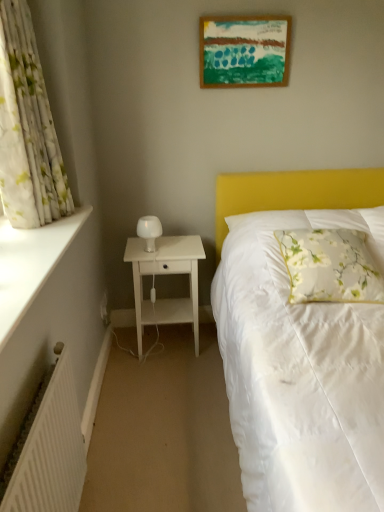
Find the location of `wooden picture frame at upper center`. wooden picture frame at upper center is located at coordinates (245, 51).

Identify the location of white matte nightstand at left. The height and width of the screenshot is (512, 384). point(163,274).

Where is `white ribbed radiator at lower left`? white ribbed radiator at lower left is located at coordinates (48, 448).

What is the approximate height of floral fabric pillow at right?

floral fabric pillow at right is 10.59 inches tall.

This screenshot has width=384, height=512. What are the coordinates of `white smooth window sill at left` in the screenshot? It's located at (x=30, y=264).

Is floral fabric pillow at right smaller than white ribbed radiator at lower left?

Incorrect, floral fabric pillow at right is not smaller in size than white ribbed radiator at lower left.

Can you confirm if floral fabric pillow at right is taller than white ribbed radiator at lower left?

No, floral fabric pillow at right is not taller than white ribbed radiator at lower left.

Considering the relative sizes of floral fabric pillow at right and white ribbed radiator at lower left in the image provided, is floral fabric pillow at right wider than white ribbed radiator at lower left?

Yes, floral fabric pillow at right is wider than white ribbed radiator at lower left.

From a real-world perspective, is white smooth window sill at left over white floral fabric curtain at left?

No, from a real-world perspective, white smooth window sill at left is not over white floral fabric curtain at left

Is point (61, 246) positioned before point (29, 181)?

That is True.

Does white smooth window sill at left contain white floral fabric curtain at left?

That's incorrect, white floral fabric curtain at left is not inside white smooth window sill at left.

Locate an element on the screen. This screenshot has height=512, width=384. curtain behind the white smooth window sill at left is located at coordinates (27, 127).

Is white floral fabric curtain at left to the left or to the right of white ribbed radiator at lower left in the image?

From the image, it's evident that white floral fabric curtain at left is to the left of white ribbed radiator at lower left.

Based on their sizes in the image, would you say white floral fabric curtain at left is bigger or smaller than white ribbed radiator at lower left?

Considering their sizes, white floral fabric curtain at left takes up more space than white ribbed radiator at lower left.

Is wooden picture frame at upper center to the left of white matte nightstand at left from the viewer's perspective?

No, wooden picture frame at upper center is not to the left of white matte nightstand at left.

From a real-world perspective, which is physically above, wooden picture frame at upper center or white matte nightstand at left?

wooden picture frame at upper center is physically above.

From the image's perspective, between wooden picture frame at upper center and white matte nightstand at left, who is located below?

white matte nightstand at left is shown below in the image.

Considering the relative sizes of wooden picture frame at upper center and white matte nightstand at left in the image provided, is wooden picture frame at upper center thinner than white matte nightstand at left?

Correct, the width of wooden picture frame at upper center is less than that of white matte nightstand at left.

Between floral fabric pillow at right and white smooth window sill at left, which one has less height?

Standing shorter between the two is white smooth window sill at left.

Who is more distant, floral fabric pillow at right or white smooth window sill at left?

floral fabric pillow at right is further from the camera.

From a real-world perspective, is floral fabric pillow at right above or below white smooth window sill at left?

In terms of real-world spatial position, floral fabric pillow at right is below white smooth window sill at left.

Between point (43, 459) and point (27, 293), which one is positioned in front?

The point (43, 459) is closer.

From a real-world perspective, who is located lower, white ribbed radiator at lower left or white smooth window sill at left?

white ribbed radiator at lower left is physically lower.

Consider the image. Would you say white ribbed radiator at lower left is inside or outside white smooth window sill at left?

white ribbed radiator at lower left exists outside the volume of white smooth window sill at left.

From the image's perspective, would you say white smooth window sill at left is positioned over white matte nightstand at left?

Yes, from the image's perspective, white smooth window sill at left is on top of white matte nightstand at left.

Which is in front, white smooth window sill at left or white matte nightstand at left?

Positioned in front is white smooth window sill at left.

Considering the relative sizes of white smooth window sill at left and white matte nightstand at left in the image provided, is white smooth window sill at left taller than white matte nightstand at left?

Incorrect, the height of white smooth window sill at left is not larger of that of white matte nightstand at left.

Is white smooth window sill at left next to white matte nightstand at left and touching it?

white smooth window sill at left is not next to white matte nightstand at left, and they're not touching.

Where is `radiator that is below the floral fabric pillow at right (from the image's perspective)`? This screenshot has height=512, width=384. radiator that is below the floral fabric pillow at right (from the image's perspective) is located at coordinates (48, 448).

This screenshot has height=512, width=384. I want to click on curtain that is behind the white smooth window sill at left, so coord(27,127).

Estimate the real-world distances between objects in this image. Which object is closer to white ribbed radiator at lower left, white glossy bedside lamp at left or white smooth window sill at left?

The object closer to white ribbed radiator at lower left is white smooth window sill at left.

Estimate the real-world distances between objects in this image. Which object is further from floral fabric pillow at right, white floral fabric curtain at left or white ribbed radiator at lower left?

white floral fabric curtain at left.

Considering their positions, is white ribbed radiator at lower left positioned closer to floral fabric pillow at right than white floral fabric curtain at left?

Based on the image, white ribbed radiator at lower left appears to be nearer to floral fabric pillow at right.

Considering their positions, is white floral fabric curtain at left positioned further to white matte nightstand at left than white ribbed radiator at lower left?

white ribbed radiator at lower left.

When comparing their distances from white floral fabric curtain at left, does white matte nightstand at left or white smooth window sill at left seem further?

white matte nightstand at left is further to white floral fabric curtain at left.

Estimate the real-world distances between objects in this image. Which object is closer to floral fabric pillow at right, white smooth window sill at left or wooden picture frame at upper center?

wooden picture frame at upper center is positioned closer to the anchor floral fabric pillow at right.

When comparing their distances from white matte nightstand at left, does white floral fabric curtain at left or white glossy bedside lamp at left seem closer?

The object closer to white matte nightstand at left is white glossy bedside lamp at left.

Looking at the image, which one is located further to white floral fabric curtain at left, white matte nightstand at left or white ribbed radiator at lower left?

white matte nightstand at left lies further to white floral fabric curtain at left than the other object.

Where is `curtain between wooden picture frame at upper center and white ribbed radiator at lower left in the vertical direction`? curtain between wooden picture frame at upper center and white ribbed radiator at lower left in the vertical direction is located at coordinates (27, 127).

At what (x,y) coordinates should I click in order to perform the action: click on nightstand located between white glossy bedside lamp at left and floral fabric pillow at right in the left-right direction. Please return your answer as a coordinate pair (x, y). The height and width of the screenshot is (512, 384). Looking at the image, I should click on (163, 274).

Find the location of a particular element. This screenshot has width=384, height=512. curtain between white smooth window sill at left and white glossy bedside lamp at left in the front-back direction is located at coordinates (27, 127).

Identify the location of radiator located between white smooth window sill at left and floral fabric pillow at right in the left-right direction. The image size is (384, 512). (48, 448).